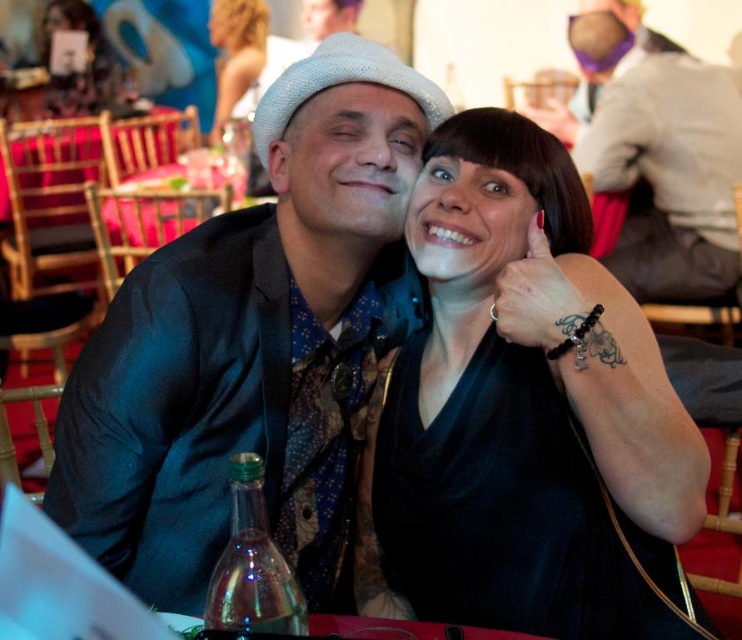
You are a photographer at a formal event. You need to capture a photo of the black matte dress at center and the matte black jacket at upper center. Which object is located lower in the image?

The black matte dress at center is positioned under the matte black jacket at upper center, so it is located lower in the image.

You are a photographer at a formal event and need to ensure that the black matte dress at center and the matte black jacket at upper center are both visible in your photo. Considering their sizes, which one might you need to adjust your camera angle to better capture?

The black matte dress at center has a lesser width compared to the matte black jacket at upper center, so you might need to adjust the camera angle to ensure the smaller black matte dress at center is clearly visible alongside the larger matte black jacket at upper center.

You are a photographer at a formal event. You need to capture a photo of the satin black suit at center and the black matte dress at center. Which one of these two items is taller?

The satin black suit at center is taller than the black matte dress at center.